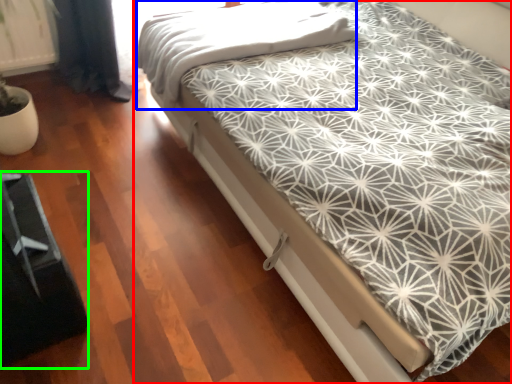
Question: Which object is the closest to the bed (highlighted by a red box)? Choose among these: blanket (highlighted by a blue box) or bed frame (highlighted by a green box).

Choices:
 (A) blanket
 (B) bed frame

Answer: (A)